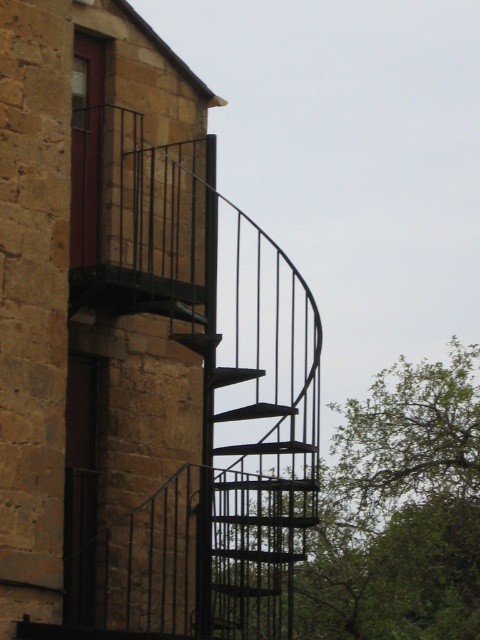
Question: Is the position of matte black staircase at upper right more distant than that of green leafy tree at right?

Choices:
 (A) yes
 (B) no

Answer: (B)

Question: Is matte black staircase at upper right closer to camera compared to green leafy tree at right?

Choices:
 (A) no
 (B) yes

Answer: (B)

Question: Which point is farther from the camera taking this photo?

Choices:
 (A) (20, 193)
 (B) (453, 627)

Answer: (B)

Question: Can you confirm if matte black staircase at upper right is smaller than green leafy tree at right?

Choices:
 (A) yes
 (B) no

Answer: (A)

Question: Which point is farther to the camera?

Choices:
 (A) (476, 515)
 (B) (52, 204)

Answer: (A)